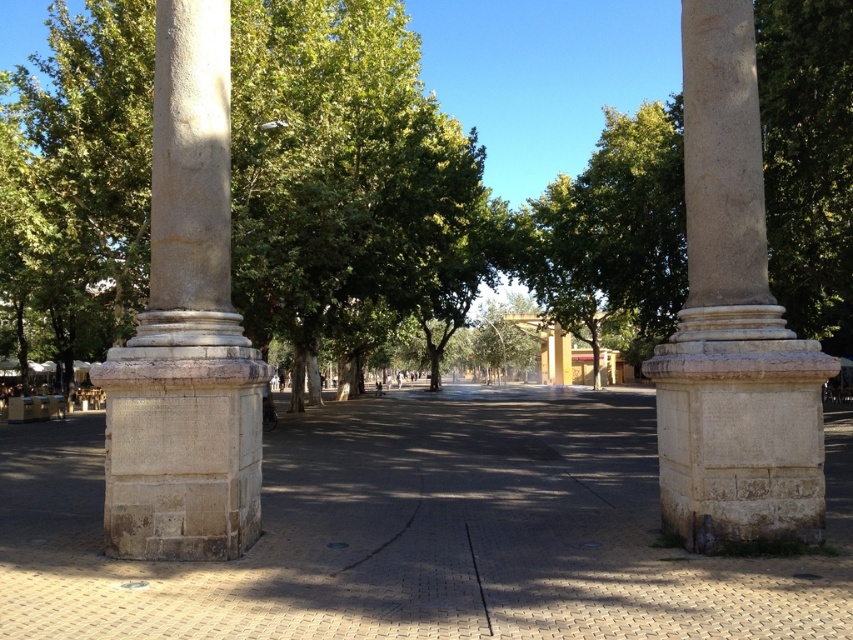
Between point (257, 477) and point (468, 547), which one is positioned behind?

The point (468, 547) is behind.

Does point (204, 60) come closer to viewer compared to point (490, 620)?

That is False.

Between point (192, 480) and point (480, 595), which one is positioned in front?

Point (480, 595)

Find the location of a particular element. Image resolution: width=853 pixels, height=640 pixels. beige stone column at left is located at coordinates (184, 326).

Between green leafy tree at center and beige stone column at right, which one is positioned higher?

green leafy tree at center is above.

Is green leafy tree at center closer to camera compared to beige stone column at right?

That is False.

Who is more distant from viewer, (323, 292) or (700, 241)?

Point (323, 292)

The width and height of the screenshot is (853, 640). I want to click on green leafy tree at center, so click(347, 177).

Does smooth stone pavement at center have a larger size compared to black glossy line at center?

Yes.

At what (x,y) coordinates should I click in order to perform the action: click on smooth stone pavement at center. Please return your answer as a coordinate pair (x, y). The image size is (853, 640). Looking at the image, I should click on (418, 532).

This screenshot has height=640, width=853. In order to click on smooth stone pavement at center in this screenshot , I will do `click(418, 532)`.